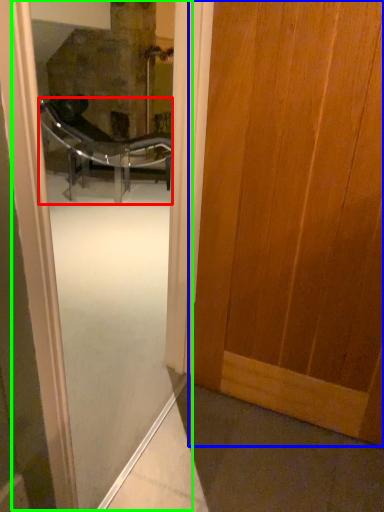
Question: Considering the real-world distances, which object is closest to chair (highlighted by a red box)? door (highlighted by a blue box) or screen door (highlighted by a green box).

Choices:
 (A) door
 (B) screen door

Answer: (B)